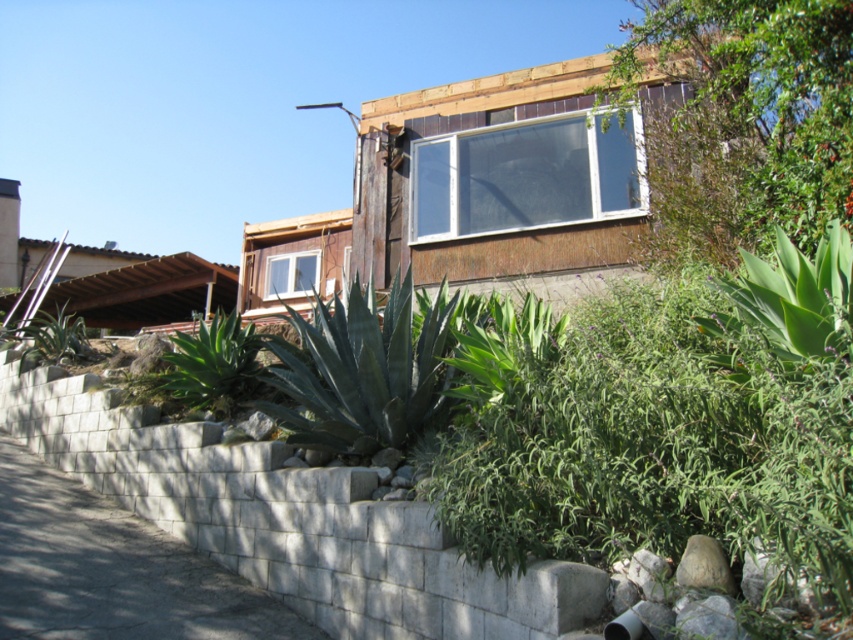
You are standing in the residential area looking at the house under construction. There are two points marked in the image. The first point is at coordinate point (316, 339) and the second is at point (42, 324). Which point is closer to you?

Point (316, 339) is closer to the viewer than point (42, 324).

You are a landscape architect designing a garden layout. You need to place a decorative stone path that must avoid the green leafy plant at center. Where should you position the path to ensure it doesn not interfere with the plant?

The green leafy plant at center is located at coordinates point [213,364], so the decorative stone path should be placed away from this point to avoid interference.